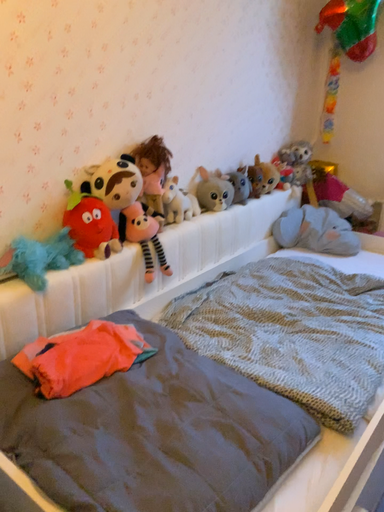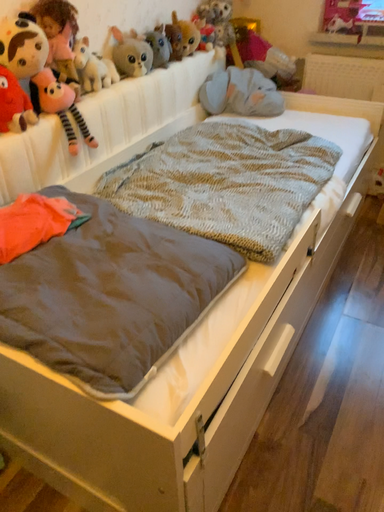
Question: Which way did the camera rotate in the video?

Choices:
 (A) rotated right
 (B) rotated left

Answer: (A)